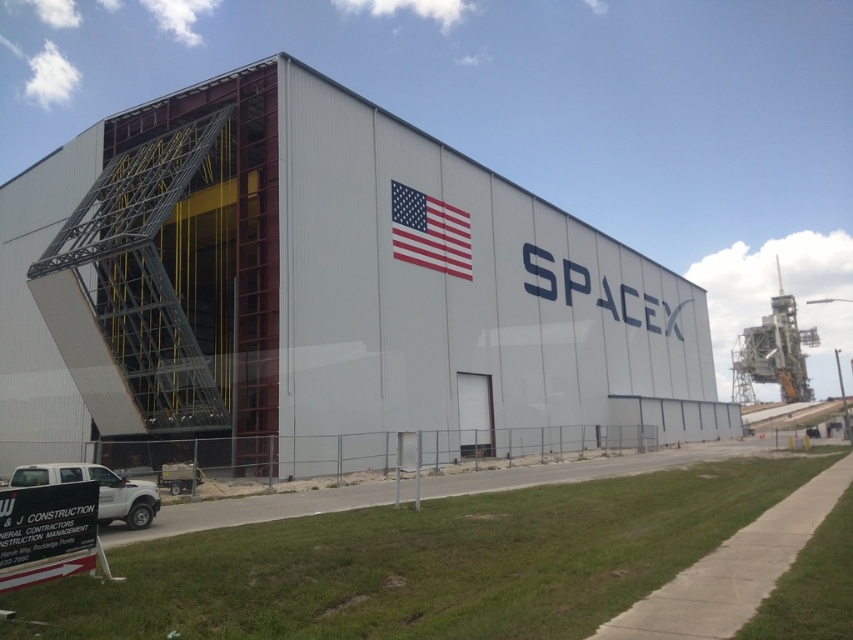
Question: Which object appears closest to the camera in this image?

Choices:
 (A) american flag at center
 (B) white matte truck at lower left
 (C) white matte hangar at center

Answer: (B)

Question: Among these objects, which one is farthest from the camera?

Choices:
 (A) american flag at center
 (B) white matte hangar at center
 (C) white matte truck at lower left

Answer: (A)

Question: Based on their relative distances, which object is farther from the white matte truck at lower left?

Choices:
 (A) white matte hangar at center
 (B) american flag at center

Answer: (A)

Question: Can you confirm if white matte hangar at center is thinner than american flag at center?

Choices:
 (A) yes
 (B) no

Answer: (B)

Question: Is white matte hangar at center positioned at the back of american flag at center?

Choices:
 (A) no
 (B) yes

Answer: (A)

Question: Where is white matte hangar at center located in relation to white matte truck at lower left in the image?

Choices:
 (A) right
 (B) left

Answer: (A)